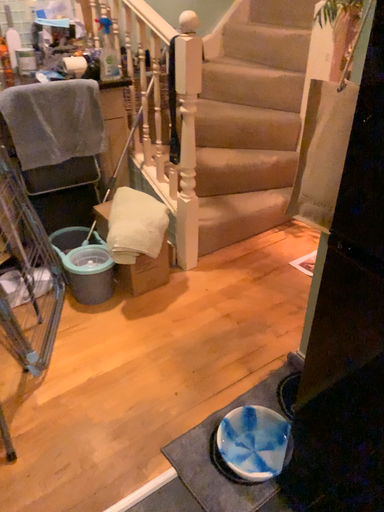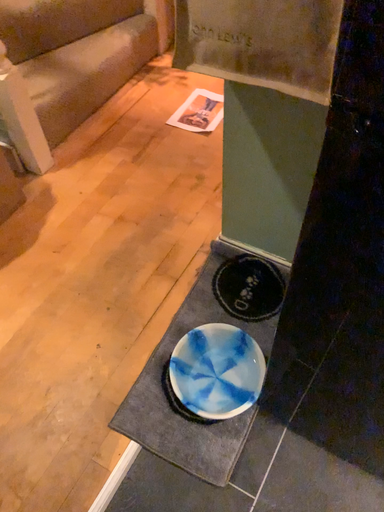
Question: How did the camera likely rotate when shooting the video?

Choices:
 (A) rotated upward
 (B) rotated downward

Answer: (B)